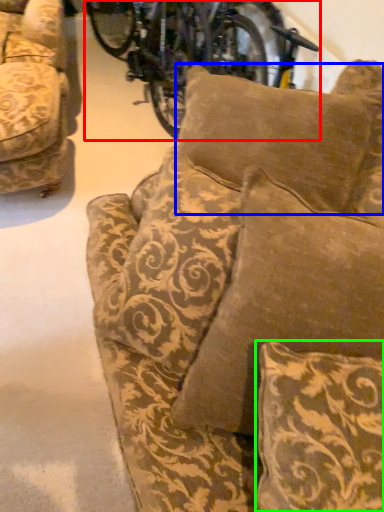
Question: Which object is the farthest from bicycle (highlighted by a red box)? Choose among these: pillow (highlighted by a blue box) or pillow (highlighted by a green box).

Choices:
 (A) pillow
 (B) pillow

Answer: (B)